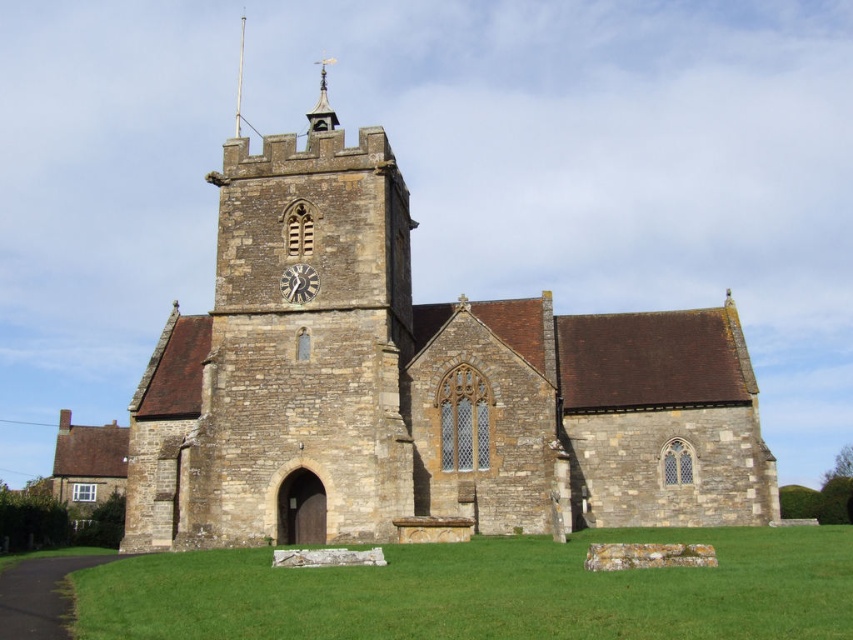
You are standing in front of the church and want to look at the stone spire at upper center. Where should you look relative to the dark gray stone clock at center?

The stone spire at upper center is located above the dark gray stone clock at center, so you should look upward from the dark gray stone clock at center to see the stone spire at upper center.

In the scene shown: You are an architect planning to install a new decorative element on the church facade. You have two options for placement based on the existing structures. The first option is to place it next to the dark gray stone clock at center, and the second is next to the stone spire at upper center. Considering their widths, which location would allow for a larger decorative element?

The stone spire at upper center has a greater width than the dark gray stone clock at center, so placing the decorative element next to the stone spire at upper center would allow for a larger decorative element.